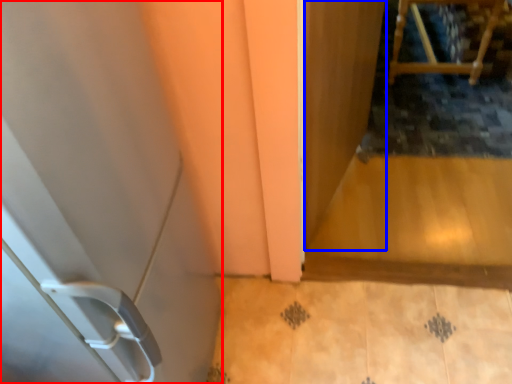
Question: Among these objects, which one is nearest to the camera, door (highlighted by a red box) or screen door (highlighted by a blue box)?

Choices:
 (A) door
 (B) screen door

Answer: (A)